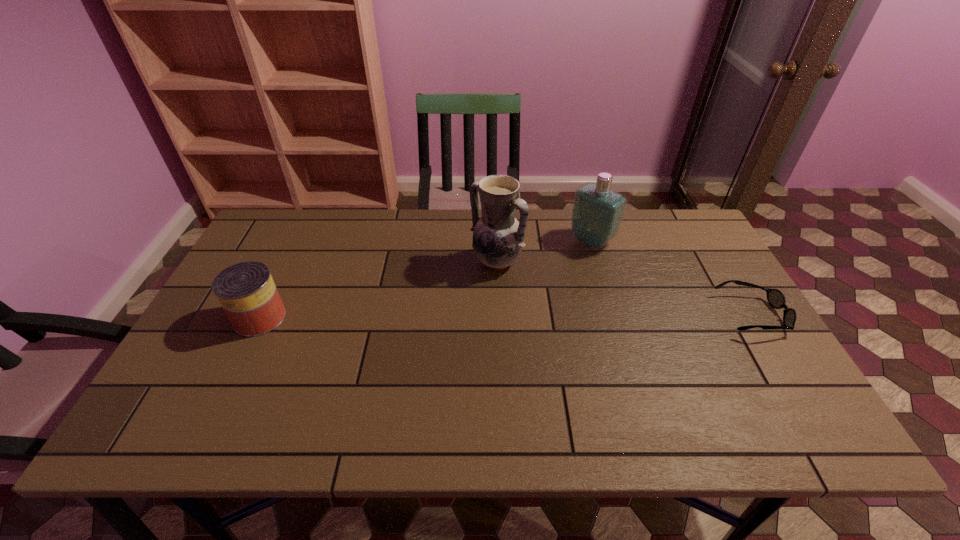
The width and height of the screenshot is (960, 540). Find the location of `vacant space located on either side of the second object from left to right`. vacant space located on either side of the second object from left to right is located at coordinates (454, 301).

Locate an element on the screen. This screenshot has height=540, width=960. free space located 0.180m on the front label of the third object from left to right is located at coordinates point(543,280).

Where is `vacant space located on the front label of the third object from left to right`? This screenshot has height=540, width=960. vacant space located on the front label of the third object from left to right is located at coordinates (531, 291).

Identify the location of blank space located on the front label of the third object from left to right. (510, 308).

Find the location of a particular element. pottery situated at the far edge is located at coordinates (498, 236).

Find the location of a particular element. perfume present at the far edge is located at coordinates (597, 213).

Find the location of `object located at the left edge`. object located at the left edge is located at coordinates (246, 291).

Where is `object at the right edge`? The image size is (960, 540). object at the right edge is located at coordinates (775, 297).

In the image, there is a desktop. What are the coordinates of `vacant space at the far edge` in the screenshot? It's located at (413, 235).

The width and height of the screenshot is (960, 540). In order to click on free space at the near edge of the desktop in this screenshot , I will do `click(263, 402)`.